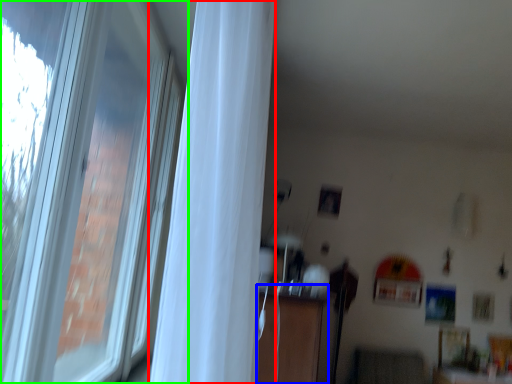
Question: Which object is the closest to the curtain (highlighted by a red box)? Choose among these: dresser (highlighted by a blue box) or window (highlighted by a green box).

Choices:
 (A) dresser
 (B) window

Answer: (B)